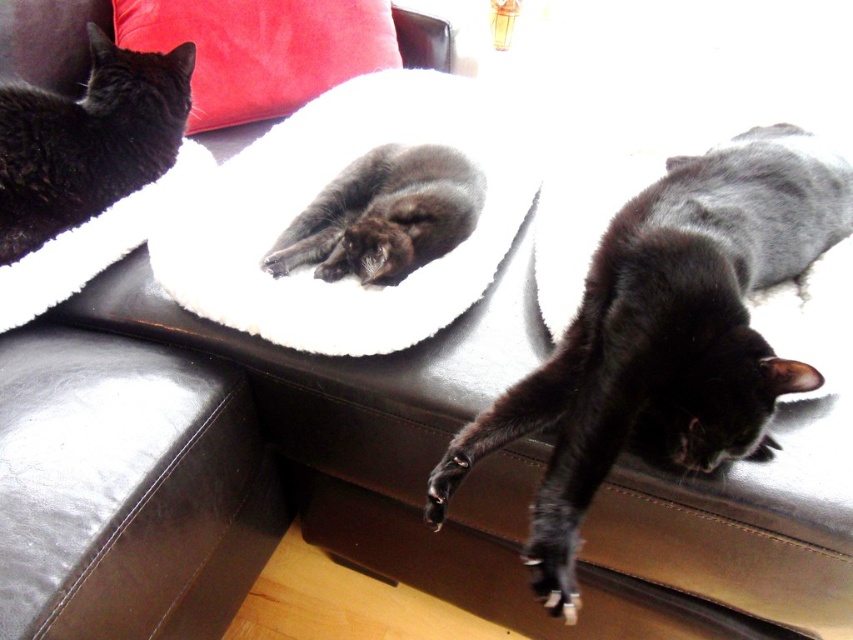
You are a cat owner trying to place a new cat toy between the white fluffy cat bed at center and the soft gray fur cat at center. Can you fit the toy if it measures 4 inches in length?

The distance between the white fluffy cat bed at center and the soft gray fur cat at center is 3.93 inches, so the 4 inch toy will not fit between them.

You are a cat owner who wants to place a new velvet red pillow at upper left on the couch where the shiny black cat at lower right is currently resting. Will the pillow fit under the cat without being crushed?

The shiny black cat at lower right is much taller than the velvet red pillow at upper left. Since the cat is taller, placing the pillow underneath might be challenging as the cat occupies more vertical space, potentially crushing the pillow.

You are a cat owner who wants to place a small toy between the black soft fur cat at upper left and the soft gray fur cat at center. Considering their heights, which cat might be more likely to reach the toy first?

The black soft fur cat at upper left is much taller than the soft gray fur cat at center, so it might be able to reach the toy first without needing to move.